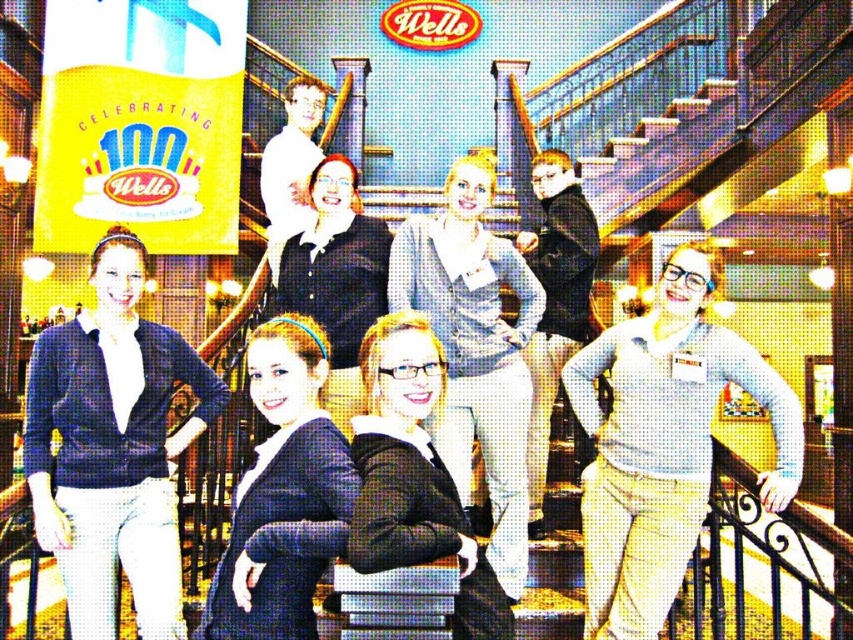
Question: Can you confirm if light gray sweater at center is positioned below white matte shirt at center?

Choices:
 (A) yes
 (B) no

Answer: (A)

Question: Is black matte blazer at center further to camera compared to matte black sweater at center?

Choices:
 (A) yes
 (B) no

Answer: (B)

Question: Which point is farther to the camera?

Choices:
 (A) matte navy cardigan at center
 (B) light blue sweater at center
 (C) light gray sweater at center

Answer: (C)

Question: Which point is farther from the camera taking this photo?

Choices:
 (A) (585, 212)
 (B) (685, 321)

Answer: (A)

Question: In this image, where is light gray sweater at center located relative to black matte blazer at center?

Choices:
 (A) left
 (B) right

Answer: (B)

Question: Which point is farther from the camera taking this photo?

Choices:
 (A) (302, 300)
 (B) (403, 396)
 (C) (248, 534)
 (D) (527, 273)

Answer: (D)